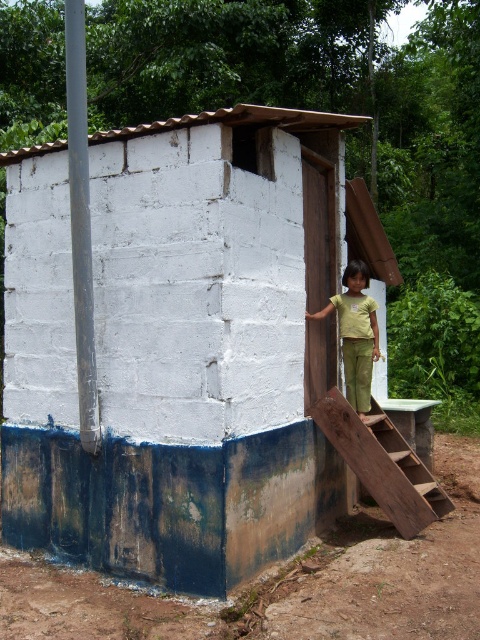
Question: Among these objects, which one is farthest from the camera?

Choices:
 (A) wooden stairs at right
 (B) white painted concrete hut at center
 (C) green cotton pants at right

Answer: (C)

Question: Is white painted concrete hut at center bigger than green cotton pants at right?

Choices:
 (A) yes
 (B) no

Answer: (A)

Question: Based on their relative distances, which object is nearer to the wooden stairs at right?

Choices:
 (A) green cotton pants at right
 (B) white painted concrete hut at center

Answer: (A)

Question: Based on their relative distances, which object is farther from the wooden stairs at right?

Choices:
 (A) green cotton pants at right
 (B) white painted concrete hut at center

Answer: (B)

Question: Is white painted concrete hut at center smaller than wooden stairs at right?

Choices:
 (A) no
 (B) yes

Answer: (A)

Question: Does wooden stairs at right appear on the right side of green cotton pants at right?

Choices:
 (A) yes
 (B) no

Answer: (A)